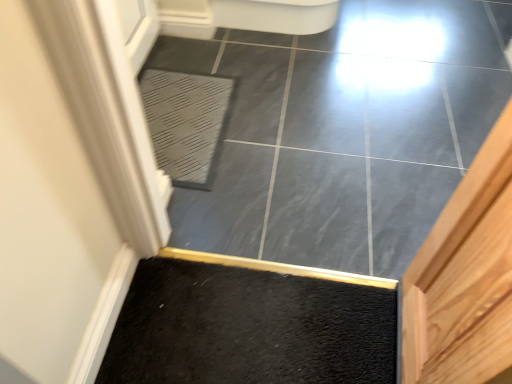
This screenshot has width=512, height=384. I want to click on free space above gray textured bath mat at center (from a real-world perspective), so pos(175,113).